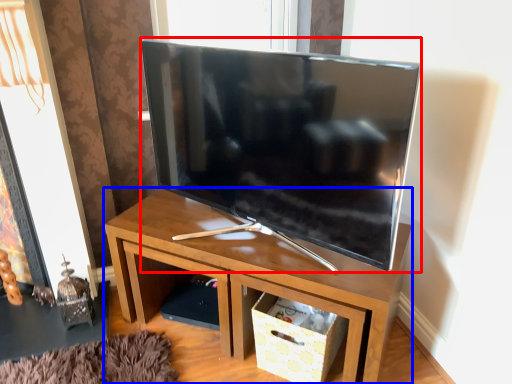
Question: Which point is further to the camera, television (highlighted by a red box) or desk (highlighted by a blue box)?

Choices:
 (A) television
 (B) desk

Answer: (B)